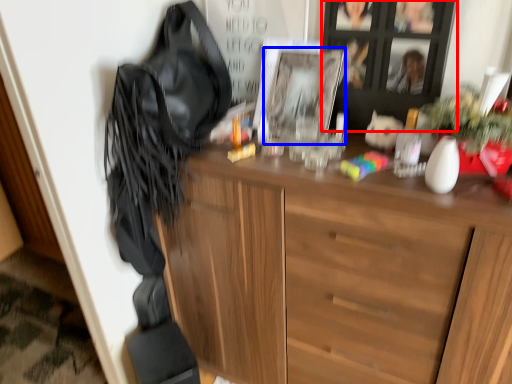
Question: Which of the following is the closest to the observer, cabinetry (highlighted by a red box) or picture frame (highlighted by a blue box)?

Choices:
 (A) cabinetry
 (B) picture frame

Answer: (A)